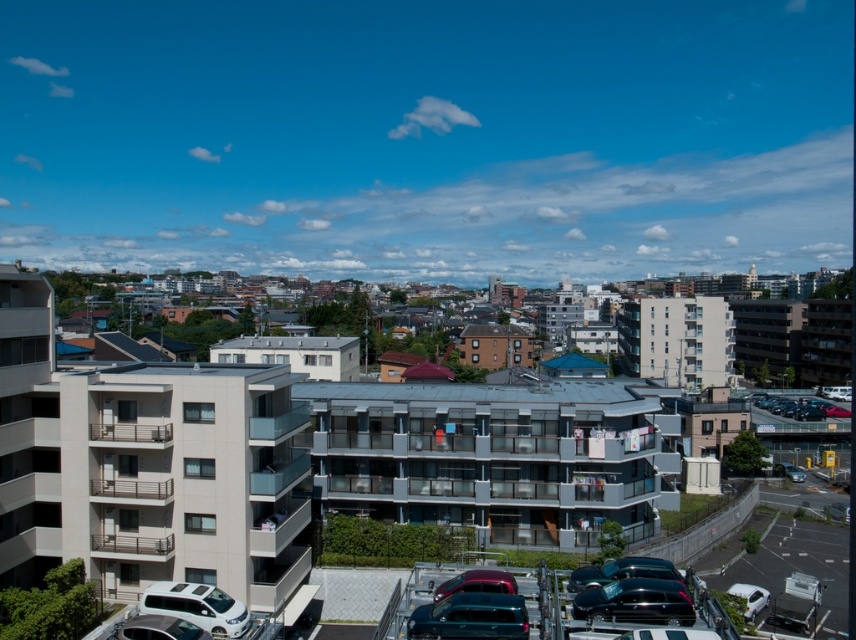
Who is taller, shiny black car at lower right or metallic silver car at lower right?

metallic silver car at lower right

Does shiny black car at lower right appear on the left side of metallic silver car at lower right?

Yes, shiny black car at lower right is to the left of metallic silver car at lower right.

Describe the element at coordinates (635, 602) in the screenshot. The height and width of the screenshot is (640, 856). I see `shiny black car at lower right` at that location.

Find the location of `shiny black car at lower right`. shiny black car at lower right is located at coordinates (635, 602).

In the scene shown: Can you confirm if white matte van at lower left is positioned below shiny red car at center?

Yes.

Does white matte van at lower left appear on the left side of shiny red car at center?

Yes, white matte van at lower left is to the left of shiny red car at center.

Is point (174, 602) more distant than point (482, 592)?

Yes, it is behind point (482, 592).

This screenshot has width=856, height=640. Identify the location of white matte van at lower left. (197, 605).

Which is below, shiny black car at lower right or white matte van at lower left?

white matte van at lower left is below.

The image size is (856, 640). What are the coordinates of `shiny black car at lower right` in the screenshot? It's located at (635, 602).

The width and height of the screenshot is (856, 640). Identify the location of shiny black car at lower right. (635, 602).

The width and height of the screenshot is (856, 640). What are the coordinates of `shiny black car at lower right` in the screenshot? It's located at (635, 602).